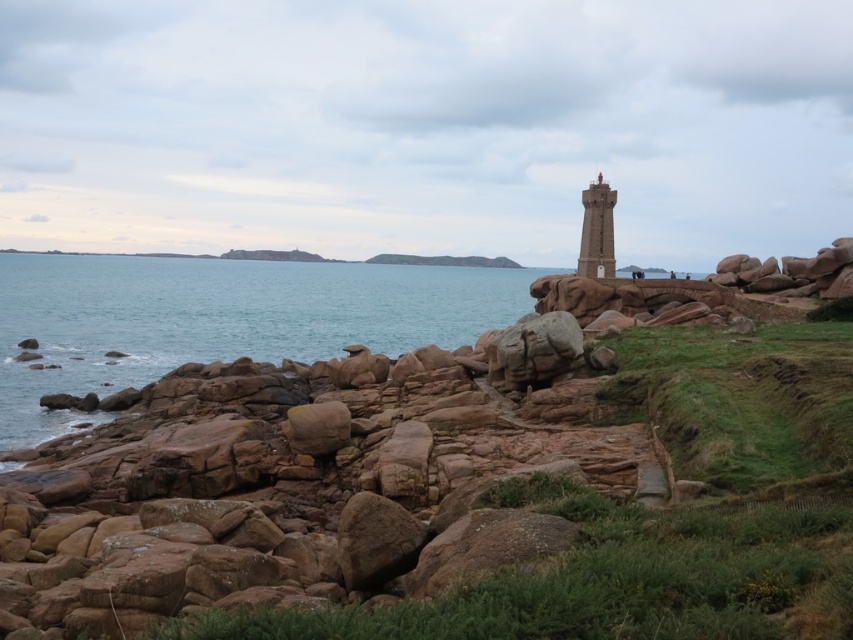
Question: Which point is farther to the camera?

Choices:
 (A) smooth stone lighthouse at center
 (B) blue water at lower left

Answer: (A)

Question: Is blue water at lower left bigger than smooth stone lighthouse at center?

Choices:
 (A) no
 (B) yes

Answer: (B)

Question: Is blue water at lower left bigger than smooth stone lighthouse at center?

Choices:
 (A) no
 (B) yes

Answer: (B)

Question: Can you confirm if blue water at lower left is positioned above smooth stone lighthouse at center?

Choices:
 (A) no
 (B) yes

Answer: (A)

Question: Which object appears closest to the camera in this image?

Choices:
 (A) blue water at lower left
 (B) smooth stone lighthouse at center

Answer: (A)